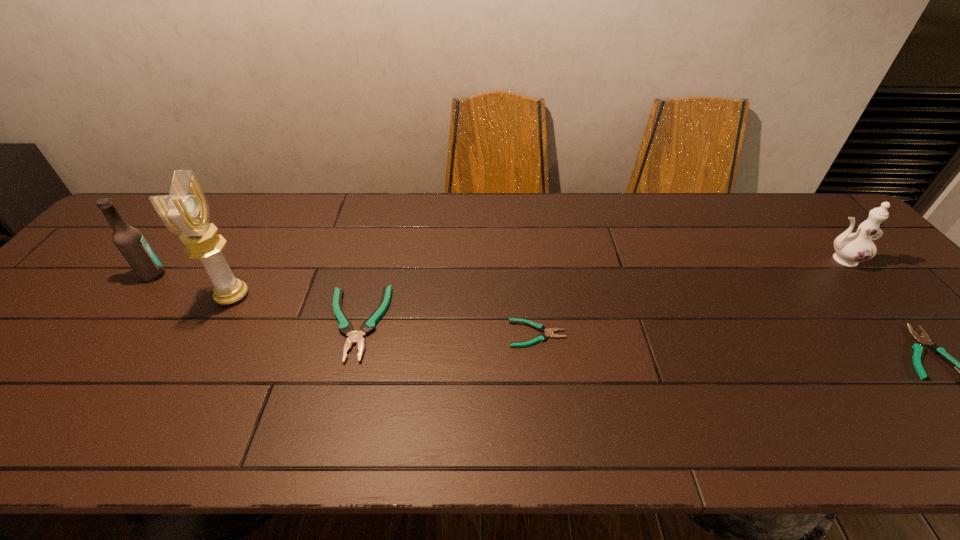
Where is `free space that satisfies the following two spatial constraints: 1. on the front-facing side of the award; 2. on the left side of the leftmost pliers`? The image size is (960, 540). free space that satisfies the following two spatial constraints: 1. on the front-facing side of the award; 2. on the left side of the leftmost pliers is located at coordinates (217, 323).

The image size is (960, 540). Identify the location of vacant space that satisfies the following two spatial constraints: 1. on the label of the second tallest object; 2. on the back side of the shortest object. (108, 334).

Locate an element on the screen. The image size is (960, 540). free space that satisfies the following two spatial constraints: 1. on the back side of the fourth object from left to right; 2. on the label of the beer bottle is located at coordinates (530, 275).